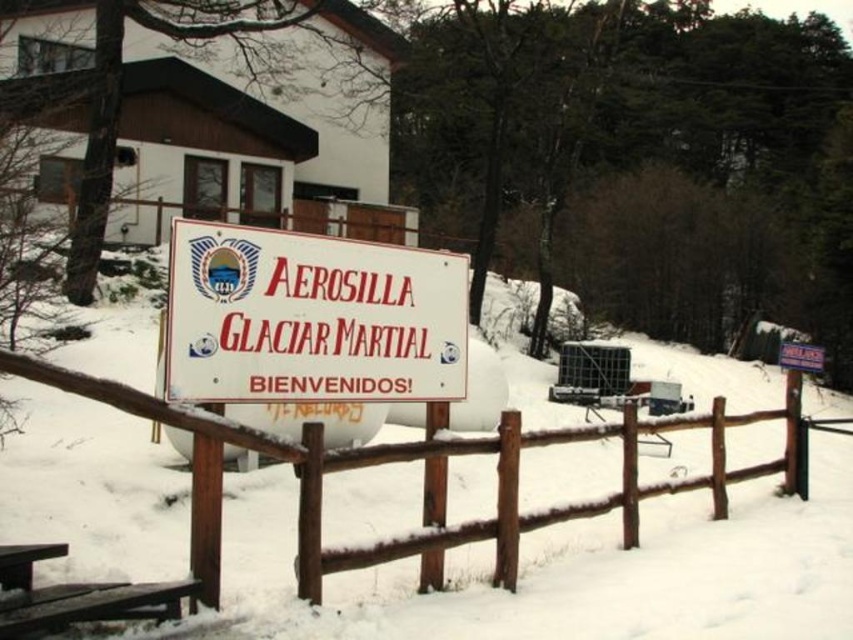
Question: Where is white matte sign at center located in relation to wooden at center in the image?

Choices:
 (A) right
 (B) left

Answer: (B)

Question: Among these objects, which one is nearest to the camera?

Choices:
 (A) white matte sign at center
 (B) wooden at center
 (C) brown wooden picnic table at lower left

Answer: (C)

Question: Among these points, which one is farthest from the camera?

Choices:
 (A) (207, 483)
 (B) (378, 326)

Answer: (B)

Question: Which of the following is the closest to the observer?

Choices:
 (A) wooden at center
 (B) brown wooden picnic table at lower left
 (C) white matte sign at center

Answer: (B)

Question: Can you confirm if wooden at center is thinner than brown wooden picnic table at lower left?

Choices:
 (A) no
 (B) yes

Answer: (B)

Question: Observing the image, what is the correct spatial positioning of white matte sign at center in reference to brown wooden picnic table at lower left?

Choices:
 (A) left
 (B) right

Answer: (B)